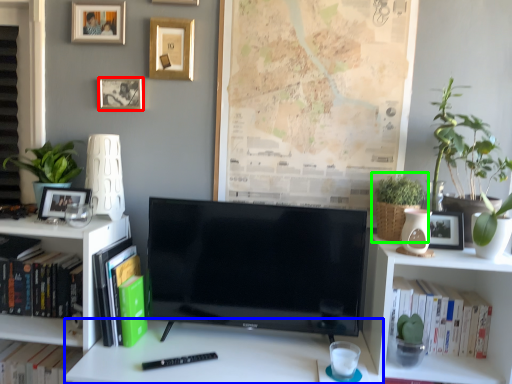
Question: Which object is positioned closest to picture frame (highlighted by a red box)? Select from desk (highlighted by a blue box) and houseplant (highlighted by a green box).

Choices:
 (A) desk
 (B) houseplant

Answer: (A)